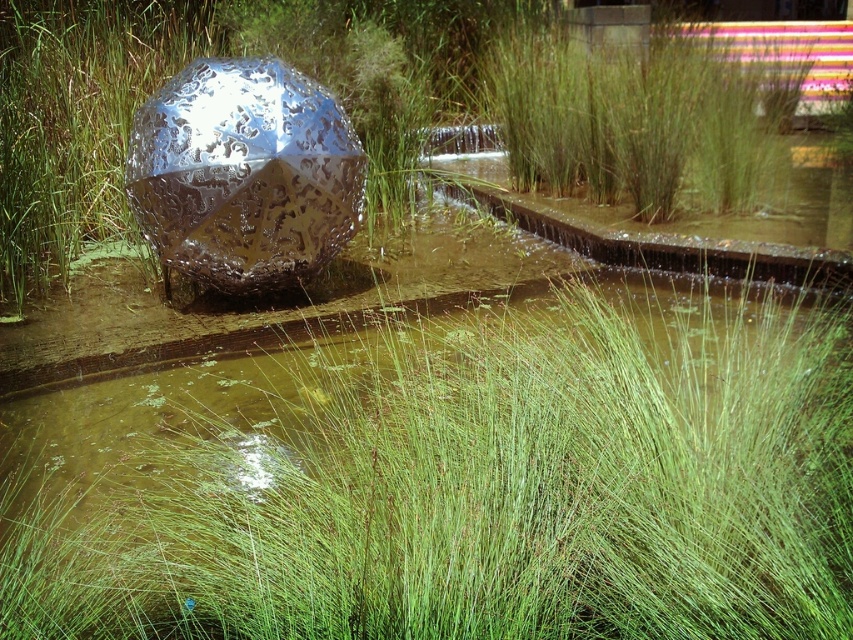
Consider the image. You are standing in the outdoor scene and want to take a photo of the metallic silver disco ball at center and the green grass at upper center. Which object will appear larger in your photo?

The metallic silver disco ball at center will appear larger in the photo because it is closer to the viewer than the green grass at upper center.

You are standing at the edge of the water and want to place a small decorative stone exactly at the center of the green grass at center. Given that the coordinate system starts at the bottom left corner of the image with x increasing to the right and y increasing upward, what are the exact coordinates where you should place the stone?

The exact coordinates to place the stone at the center of the green grass at center are point (454,481).